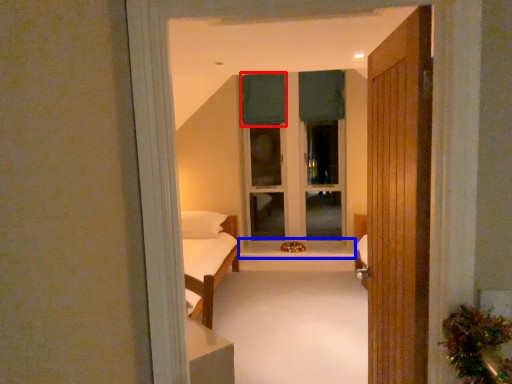
Question: Which point is closer to the camera, curtain (highlighted by a red box) or window sill (highlighted by a blue box)?

Choices:
 (A) curtain
 (B) window sill

Answer: (B)